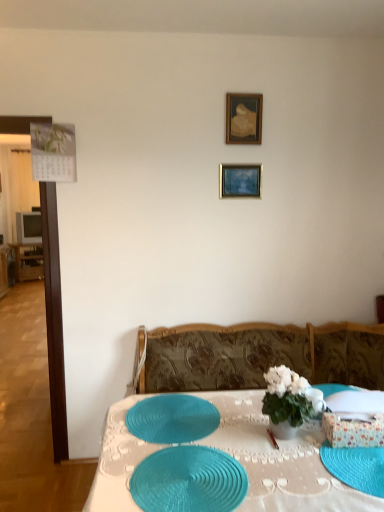
The height and width of the screenshot is (512, 384). What are the coordinates of `vacant space situated on the left part of white glossy vase at center` in the screenshot? It's located at (241, 433).